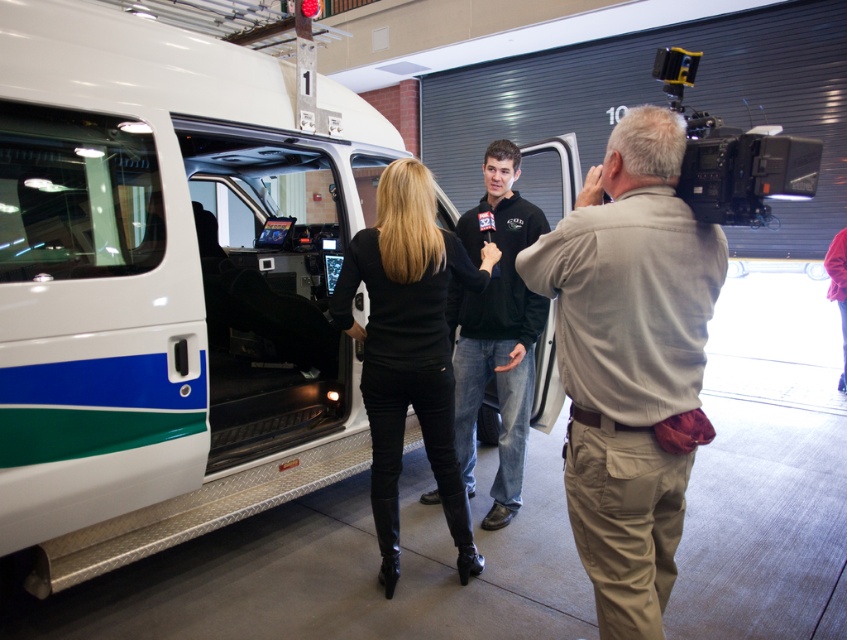
Does khaki cotton shirt at center have a lesser height compared to black fleece at center?

Indeed, khaki cotton shirt at center has a lesser height compared to black fleece at center.

Does point (635, 618) lie behind point (523, 392)?

No, it is not.

Locate an element on the screen. Image resolution: width=847 pixels, height=640 pixels. khaki cotton shirt at center is located at coordinates (629, 360).

Is the position of khaki cotton shirt at center less distant than that of black leather pants at center?

That is True.

Is khaki cotton shirt at center wider than black leather pants at center?

No.

Is point (639, 244) positioned before point (428, 304)?

Yes, point (639, 244) is in front of point (428, 304).

Image resolution: width=847 pixels, height=640 pixels. I want to click on khaki cotton shirt at center, so click(629, 360).

Does white glossy van at center appear on the left side of khaki cotton shirt at center?

Correct, you'll find white glossy van at center to the left of khaki cotton shirt at center.

Is point (40, 268) behind point (657, 170)?

Yes, point (40, 268) is behind point (657, 170).

Between point (97, 61) and point (613, 342), which one is positioned behind?

Positioned behind is point (97, 61).

I want to click on white glossy van at center, so pos(165,285).